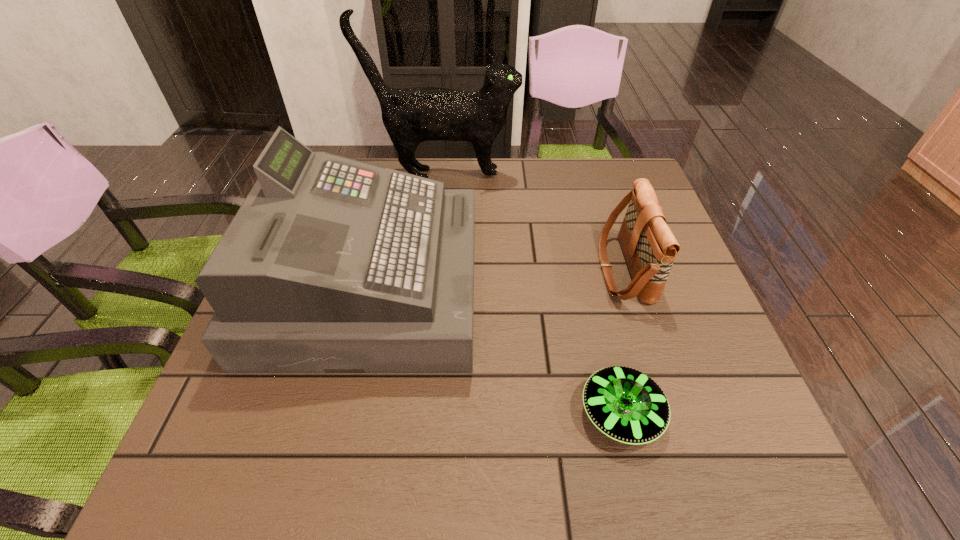
Find the location of a particular element. The width and height of the screenshot is (960, 540). the farthest object is located at coordinates (412, 115).

Identify the location of the tallest object. The image size is (960, 540). [x=412, y=115].

Identify the location of cash register. (331, 265).

At what (x,y) coordinates should I click in order to perform the action: click on the third tallest object. Please return your answer as a coordinate pair (x, y). The image size is (960, 540). Looking at the image, I should click on (649, 246).

Identify the location of the nearest object. (625, 404).

Identify the location of saucer. The width and height of the screenshot is (960, 540). (625, 404).

The width and height of the screenshot is (960, 540). Find the location of `vacant space located on the face of the tallest object`. vacant space located on the face of the tallest object is located at coordinates (595, 174).

Locate an element on the screen. The width and height of the screenshot is (960, 540). vacant space located 0.060m on the front-facing side of the cash register is located at coordinates (501, 287).

At what (x,y) coordinates should I click in order to perform the action: click on free space located 0.050m on the front-facing side of the second shortest object. Please return your answer as a coordinate pair (x, y). This screenshot has height=540, width=960. Looking at the image, I should click on (579, 269).

Locate an element on the screen. Image resolution: width=960 pixels, height=540 pixels. vacant space located 0.090m on the front-facing side of the second shortest object is located at coordinates (562, 269).